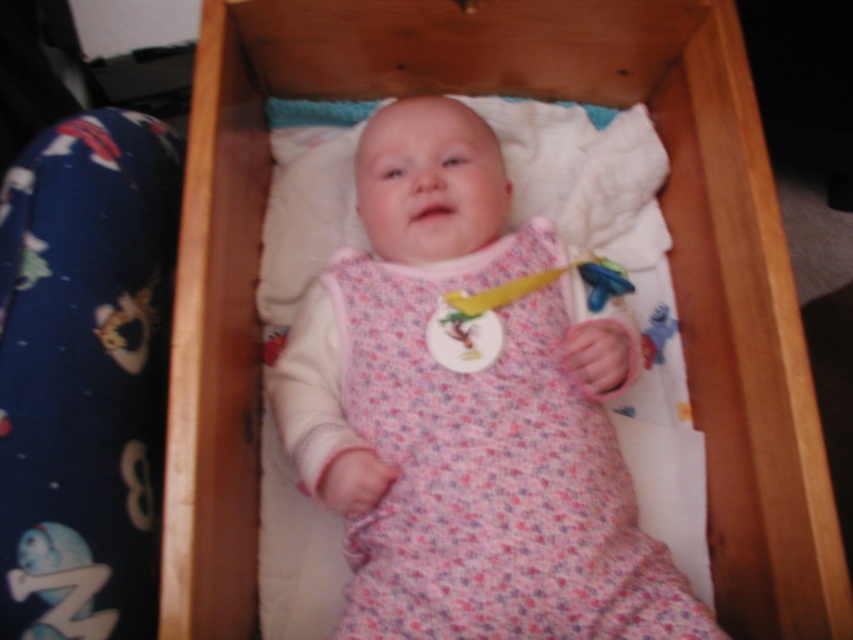
Is pink floral fabric baby at center further to the viewer compared to blue rubber toy at lower left?

Yes, pink floral fabric baby at center is behind blue rubber toy at lower left.

In the scene shown: Is pink floral fabric baby at center smaller than blue rubber toy at lower left?

No, pink floral fabric baby at center is not smaller than blue rubber toy at lower left.

Find the location of `pink floral fabric baby at center`. pink floral fabric baby at center is located at coordinates (469, 417).

Describe the element at coordinates (61, 582) in the screenshot. I see `blue rubber toy at lower left` at that location.

Does blue rubber toy at lower left come in front of pink fabric rattle at center?

Yes, blue rubber toy at lower left is closer to the viewer.

The width and height of the screenshot is (853, 640). What do you see at coordinates (61, 582) in the screenshot?
I see `blue rubber toy at lower left` at bounding box center [61, 582].

I want to click on blue rubber toy at lower left, so click(61, 582).

Between pink floral fabric baby at center and pink fabric rattle at center, which one has more height?

With more height is pink floral fabric baby at center.

Between pink floral fabric baby at center and pink fabric rattle at center, which one has less height?

pink fabric rattle at center is shorter.

Who is more forward, (622, 637) or (456, 294)?

Point (622, 637) is more forward.

Where is `pink floral fabric baby at center`? pink floral fabric baby at center is located at coordinates (469, 417).